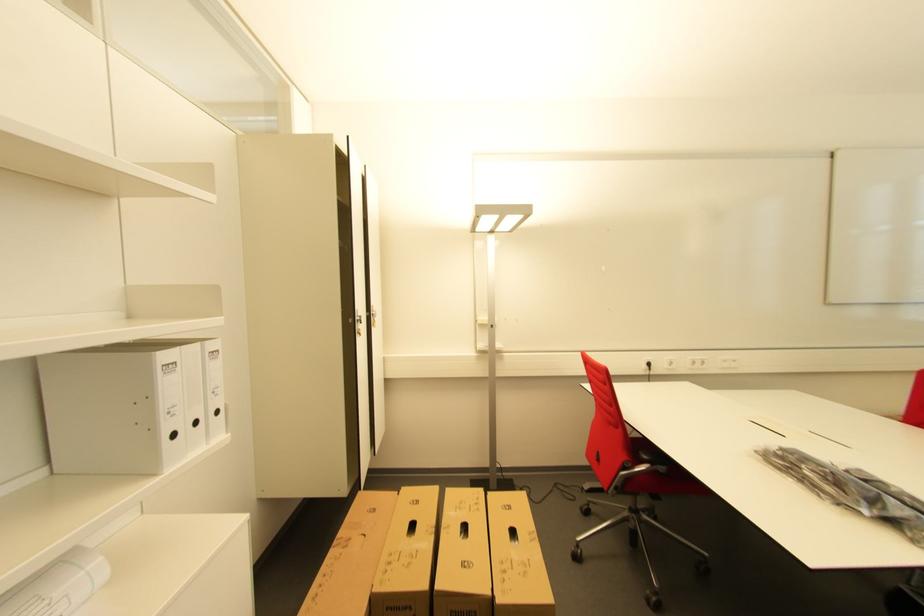
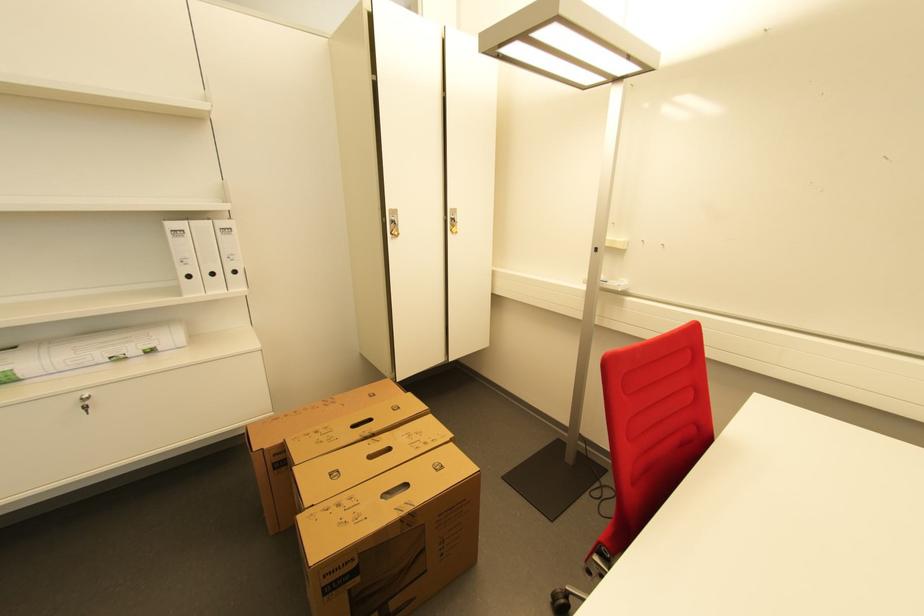
Where in the second image is the point corresponding to point 168,358 from the first image?

(176, 225)